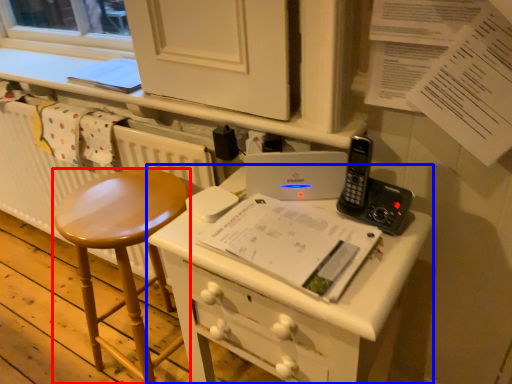
Question: Among these objects, which one is nearest to the camera, stool (highlighted by a red box) or desk (highlighted by a blue box)?

Choices:
 (A) stool
 (B) desk

Answer: (B)